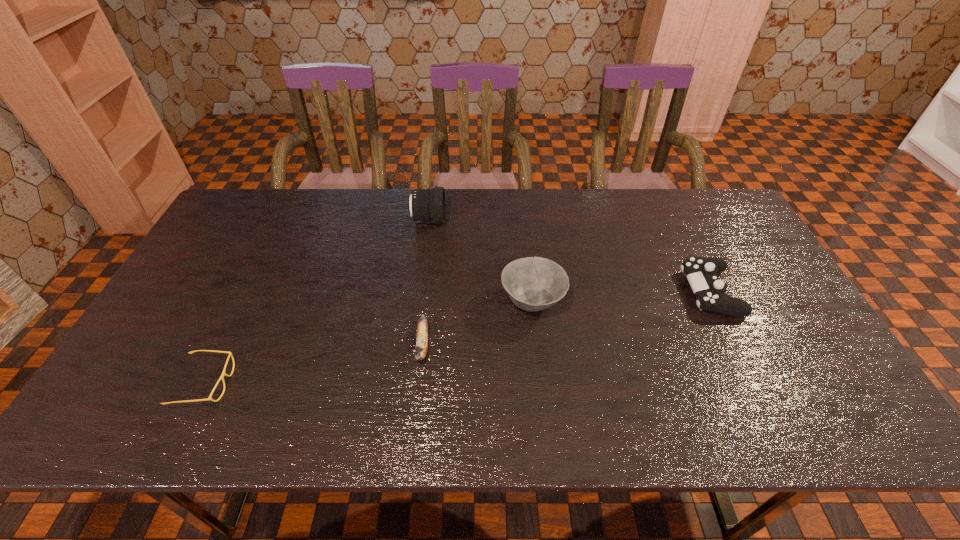
This screenshot has width=960, height=540. Find the location of `vacant position at the far edge of the desktop`. vacant position at the far edge of the desktop is located at coordinates (403, 229).

This screenshot has width=960, height=540. Identify the location of vacant space at the near edge. (422, 436).

In the image, there is a desktop. Where is `vacant space at the left edge`? The width and height of the screenshot is (960, 540). vacant space at the left edge is located at coordinates (222, 272).

You are a GUI agent. You are given a task and a screenshot of the screen. Output one action in this format:
    pyautogui.click(x=<x>, y=<y>)
    Task: Click on the vacant point at the right edge
    Image resolution: width=960 pixels, height=540 pixels.
    Given the screenshot: What is the action you would take?
    pyautogui.click(x=805, y=340)

At what (x,y) coordinates should I click in order to perform the action: click on vacant region at the far left corner of the desktop. Please return your answer as a coordinate pair (x, y). Looking at the image, I should click on (249, 215).

The height and width of the screenshot is (540, 960). Identify the location of free space at the far right corner of the desktop. (707, 228).

Where is `empty location between the fourth object from left to right and the shortest object`? empty location between the fourth object from left to right and the shortest object is located at coordinates (369, 342).

Find the location of a particular element. This screenshot has height=540, width=960. free space between the banana and the second tallest object is located at coordinates (477, 323).

The image size is (960, 540). In order to click on free point between the tallest object and the second object from right to left in this screenshot , I will do `click(480, 261)`.

Locate an element on the screen. The image size is (960, 540). vacant space that's between the banana and the farthest object is located at coordinates (425, 282).